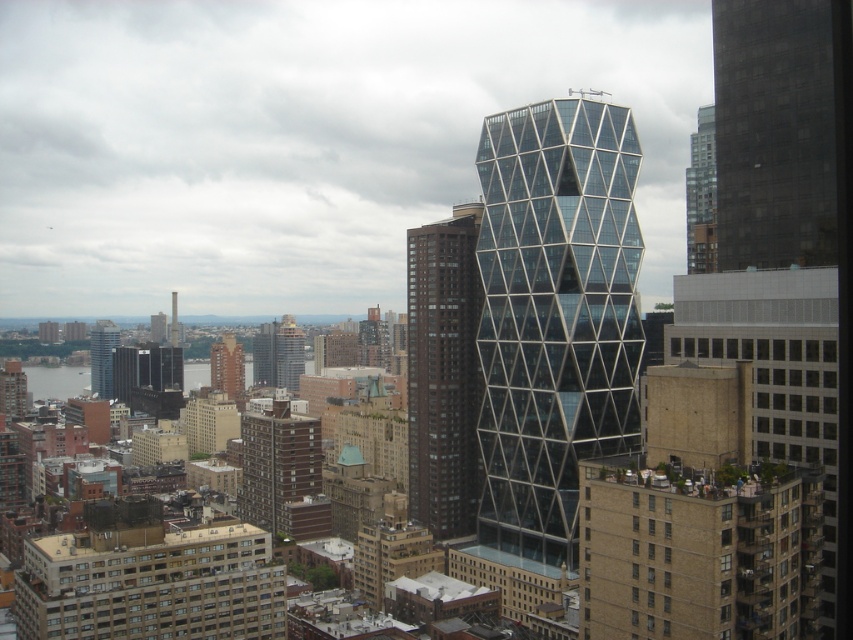
You are a city planner assessing the potential for a new public park between the brown glassy building at center and the brick building at center. Given that the minimum required distance for such a park is 150 meters between adjacent structures, will the current distance suffice?

The distance between the brown glassy building at center and the brick building at center is 137.32 meters, which is less than the required 150 meters. Therefore, the current distance does not suffice for the new public park.

You are standing at the center of the city and see two points in the scene. The first point is labeled as point (817,243) and the second is point (99,380). Which point is closer to you?

Point (817,243) is closer to you because it is in front of point (99,380).